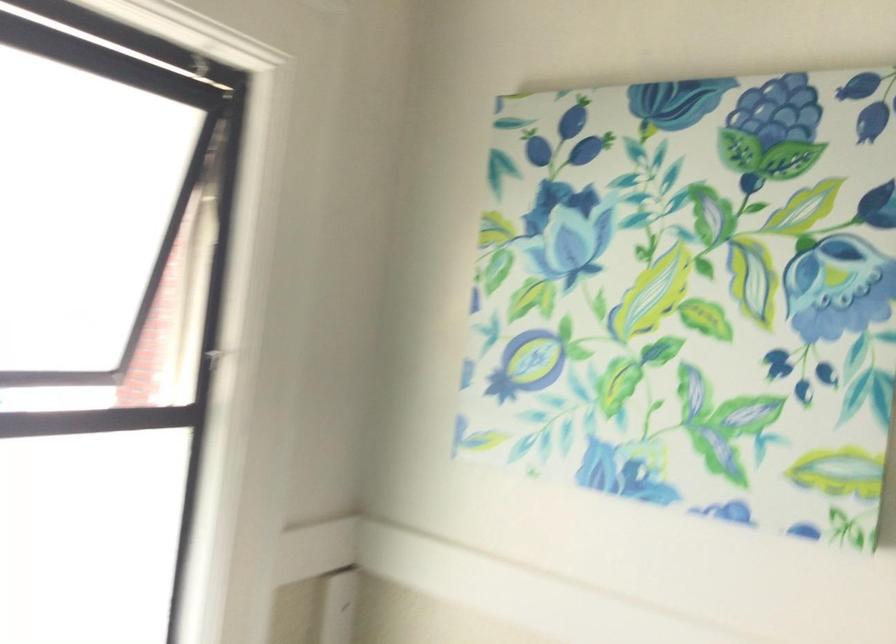
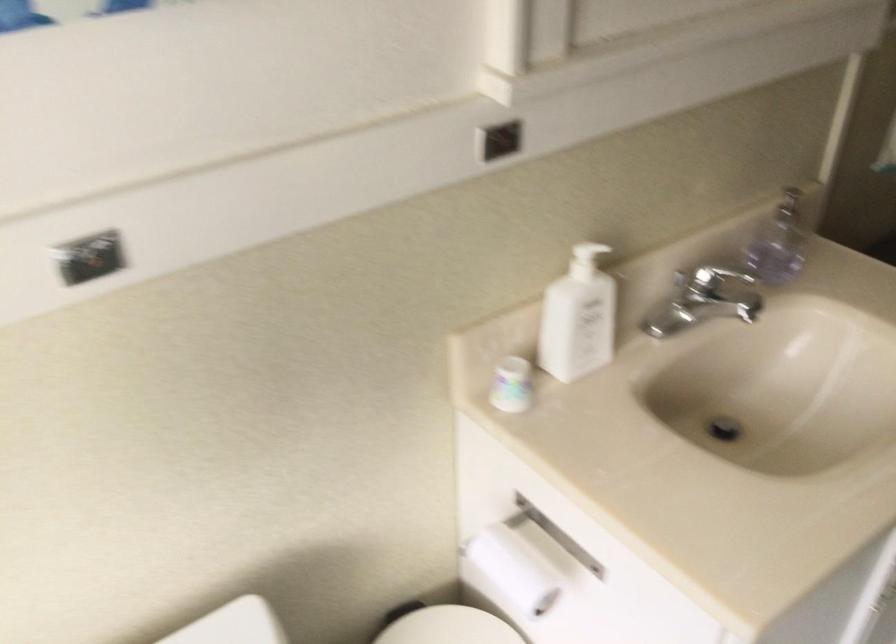
The first image is from the beginning of the video and the second image is from the end. How did the camera likely rotate when shooting the video?

The camera rotated toward right-down.